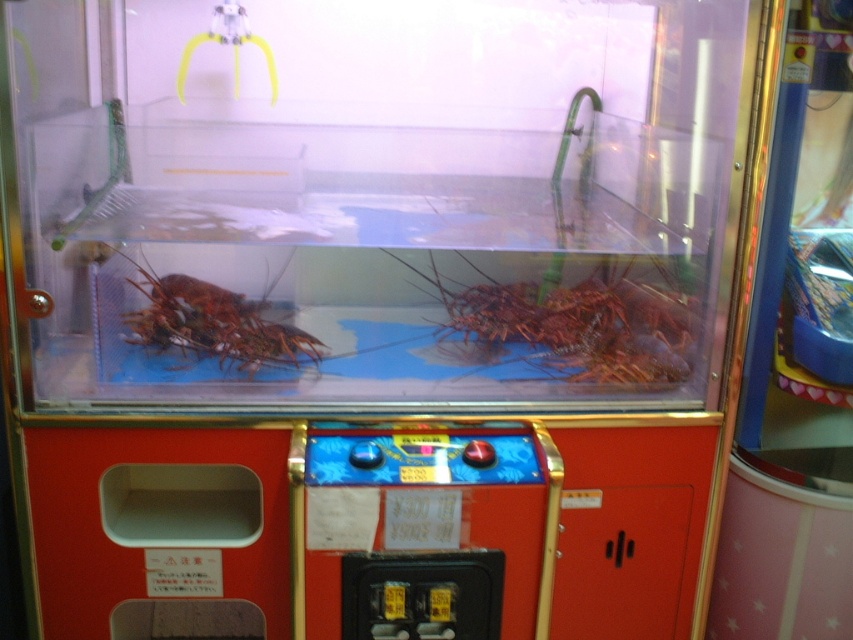
Question: Which of the following is the closest to the observer?

Choices:
 (A) shiny red lobster at center
 (B) red matte lobster at left

Answer: (B)

Question: Is shiny red lobster at center below red matte lobster at left?

Choices:
 (A) no
 (B) yes

Answer: (A)

Question: Can you confirm if shiny red lobster at center is wider than red matte lobster at left?

Choices:
 (A) yes
 (B) no

Answer: (A)

Question: Does shiny red lobster at center appear over red matte lobster at left?

Choices:
 (A) yes
 (B) no

Answer: (A)